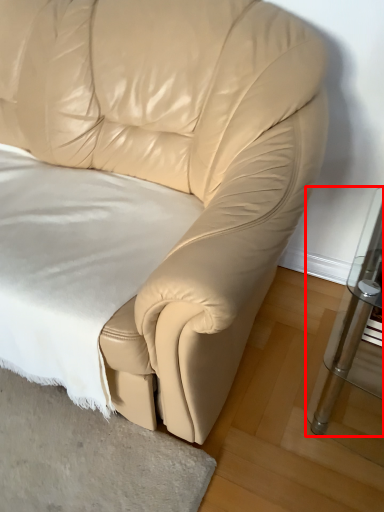
Question: From the image's perspective, what is the correct spatial relationship of table (annotated by the red box) in relation to sheet?

Choices:
 (A) above
 (B) below

Answer: (B)